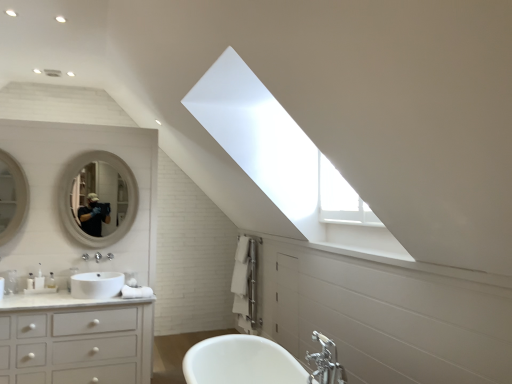
Question: Does matte white mirror at left, which is the 2th mirror from back to front, lie behind white glossy bathtub at center?

Choices:
 (A) no
 (B) yes

Answer: (B)

Question: From a real-world perspective, is matte white mirror at left, which is the second mirror from right to left, beneath white glossy bathtub at center?

Choices:
 (A) yes
 (B) no

Answer: (B)

Question: Could you tell me if matte white mirror at left, the 1th mirror positioned from the front, is turned towards white glossy bathtub at center?

Choices:
 (A) no
 (B) yes

Answer: (A)

Question: Considering the relative sizes of matte white mirror at left, the 1th mirror positioned from the front, and white glossy bathtub at center in the image provided, is matte white mirror at left, the 1th mirror positioned from the front, smaller than white glossy bathtub at center?

Choices:
 (A) yes
 (B) no

Answer: (A)

Question: Considering the relative sizes of matte white mirror at left, which is the second mirror from right to left, and white glossy bathtub at center in the image provided, is matte white mirror at left, which is the second mirror from right to left, taller than white glossy bathtub at center?

Choices:
 (A) yes
 (B) no

Answer: (A)

Question: Does matte white mirror at left, the 1th mirror positioned from the front, appear on the right side of white glossy bathtub at center?

Choices:
 (A) no
 (B) yes

Answer: (A)

Question: Is white glossy mirror at upper left, the 1th mirror viewed from the right, looking in the opposite direction of matte white mirror at left, which is the second mirror from right to left?

Choices:
 (A) yes
 (B) no

Answer: (B)

Question: Can you confirm if white glossy mirror at upper left, the 2th mirror when ordered from left to right, is taller than matte white mirror at left, acting as the first mirror starting from the left?

Choices:
 (A) no
 (B) yes

Answer: (B)

Question: Is white glossy mirror at upper left, the 1th mirror viewed from the right, facing towards matte white mirror at left, acting as the first mirror starting from the left?

Choices:
 (A) yes
 (B) no

Answer: (B)

Question: From the image's perspective, is white glossy mirror at upper left, the 1th mirror viewed from the right, below matte white mirror at left, the 1th mirror positioned from the front?

Choices:
 (A) yes
 (B) no

Answer: (A)

Question: Would you say white glossy mirror at upper left, the 1th mirror viewed from the right, is outside matte white mirror at left, which is the second mirror from right to left?

Choices:
 (A) no
 (B) yes

Answer: (B)

Question: Is white glossy mirror at upper left, the 2th mirror when ordered from left to right, at the left side of matte white mirror at left, acting as the first mirror starting from the left?

Choices:
 (A) yes
 (B) no

Answer: (B)

Question: Is white glossy bathtub at center bigger than white glossy sink at lower left?

Choices:
 (A) no
 (B) yes

Answer: (B)